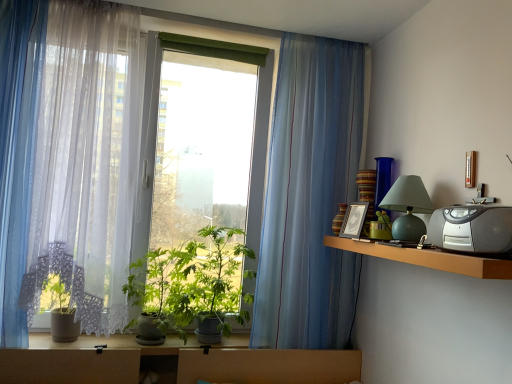
Question: Is green matte plant at center turned away from matte green glass table lamp at right?

Choices:
 (A) no
 (B) yes

Answer: (A)

Question: Is green matte plant at center positioned behind matte green glass table lamp at right?

Choices:
 (A) no
 (B) yes

Answer: (B)

Question: Would you say green matte plant at center is outside matte green glass table lamp at right?

Choices:
 (A) yes
 (B) no

Answer: (A)

Question: Does green matte plant at center have a lesser height compared to matte green glass table lamp at right?

Choices:
 (A) no
 (B) yes

Answer: (A)

Question: Considering the relative positions of green matte plant at center and matte green glass table lamp at right in the image provided, is green matte plant at center to the right of matte green glass table lamp at right from the viewer's perspective?

Choices:
 (A) yes
 (B) no

Answer: (B)

Question: Are green matte plant at center and matte green glass table lamp at right located far from each other?

Choices:
 (A) no
 (B) yes

Answer: (B)

Question: Can you confirm if brown wooden shelf at right is bigger than green matte plant at center?

Choices:
 (A) yes
 (B) no

Answer: (B)

Question: Is brown wooden shelf at right positioned behind green matte plant at center?

Choices:
 (A) no
 (B) yes

Answer: (A)

Question: Can you confirm if brown wooden shelf at right is shorter than green matte plant at center?

Choices:
 (A) no
 (B) yes

Answer: (B)

Question: Would you say brown wooden shelf at right is a long distance from green matte plant at center?

Choices:
 (A) no
 (B) yes

Answer: (A)

Question: Considering the relative sizes of brown wooden shelf at right and green matte plant at center in the image provided, is brown wooden shelf at right taller than green matte plant at center?

Choices:
 (A) yes
 (B) no

Answer: (B)

Question: From a real-world perspective, is brown wooden shelf at right over green matte plant at center?

Choices:
 (A) no
 (B) yes

Answer: (B)

Question: Is matte green glass table lamp at right located outside translucent fabric curtain at left, which is the 3th curtain from right to left?

Choices:
 (A) yes
 (B) no

Answer: (A)